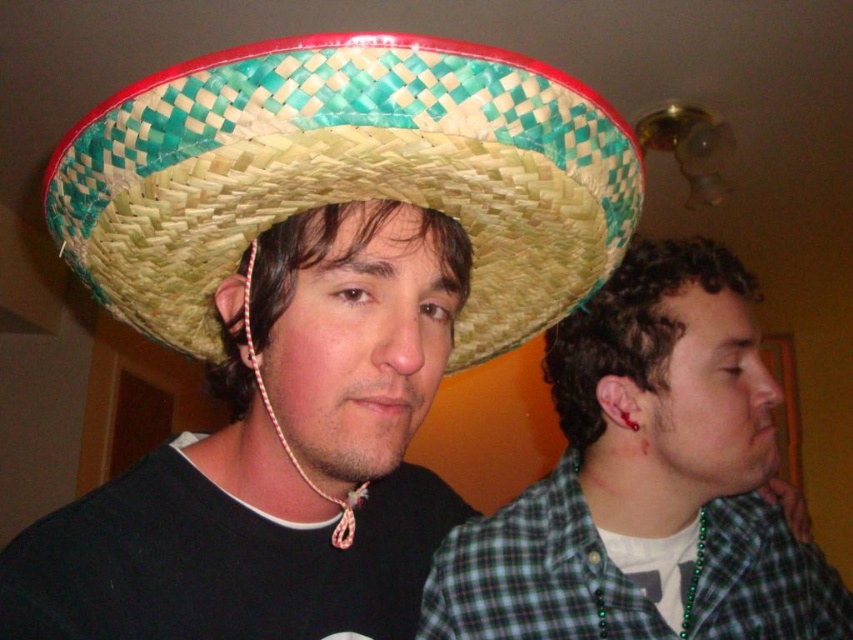
Question: Which of the following is the closest to the observer?

Choices:
 (A) pos(169,186)
 (B) pos(664,400)

Answer: (A)

Question: Can you confirm if woven straw sombrero at center is smaller than green plaid shirt at right?

Choices:
 (A) no
 (B) yes

Answer: (B)

Question: Which object is farther from the camera taking this photo?

Choices:
 (A) woven straw sombrero at center
 (B) green plaid shirt at right

Answer: (B)

Question: Does woven straw sombrero at center appear on the right side of green plaid shirt at right?

Choices:
 (A) no
 (B) yes

Answer: (A)

Question: Which object is closer to the camera taking this photo?

Choices:
 (A) woven straw sombrero at center
 (B) green plaid shirt at right

Answer: (A)

Question: Can you confirm if woven straw sombrero at center is positioned below green plaid shirt at right?

Choices:
 (A) no
 (B) yes

Answer: (A)